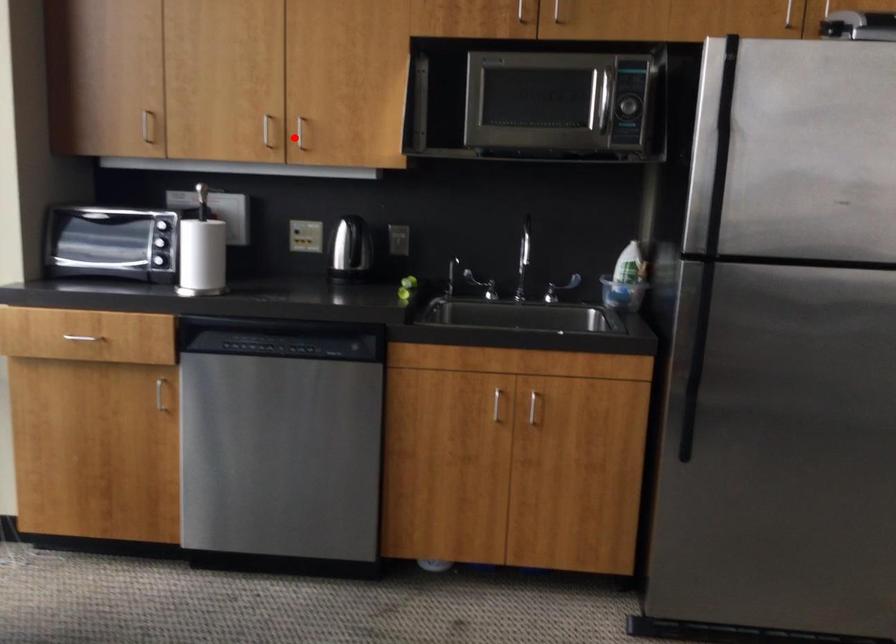
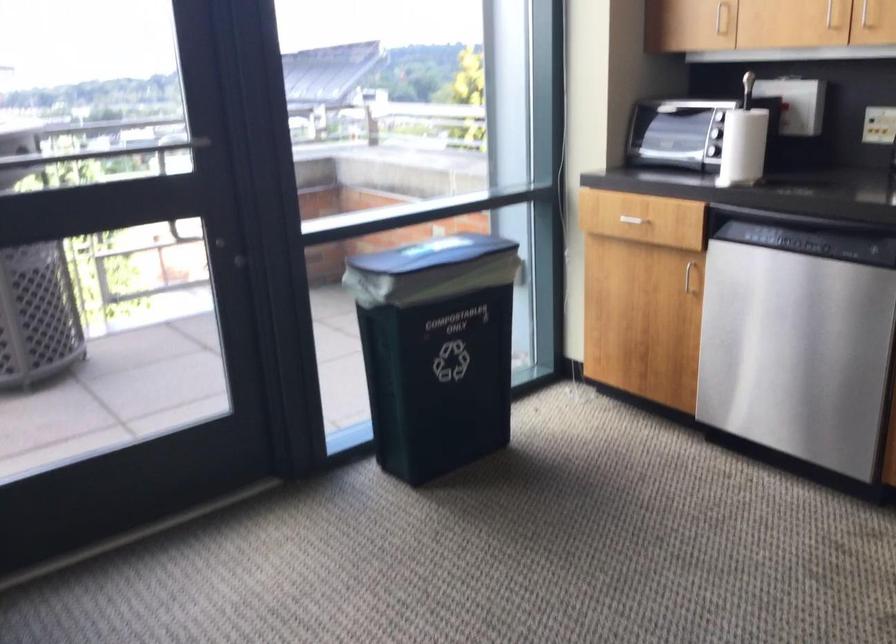
Question: I am providing you with two images of the same scene from different viewpoints. Image1 has a red point marked. In image2, the corresponding 3D location appears at what relative position? Reply with the corresponding letter.

Choices:
 (A) Closer
 (B) Farther

Answer: (A)